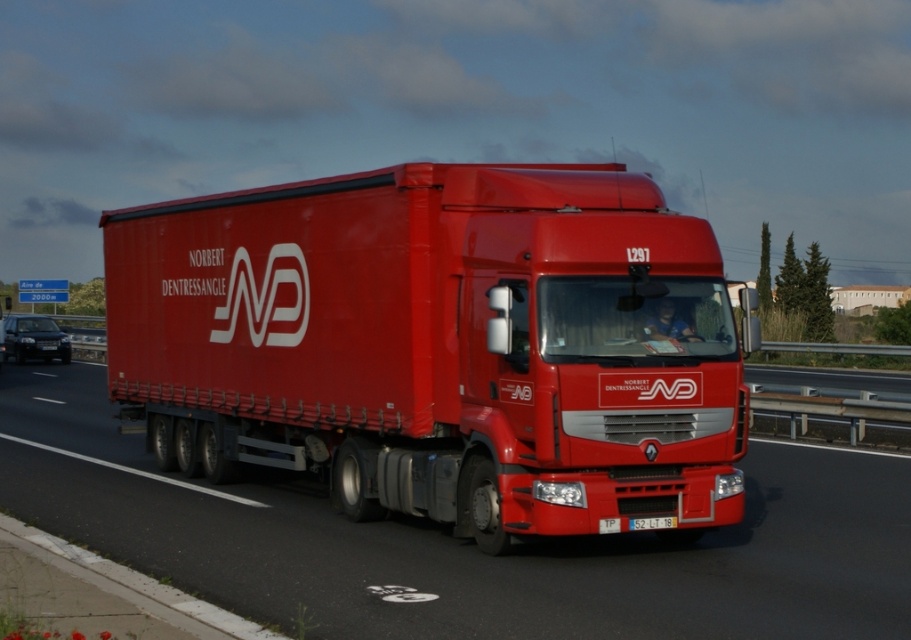
You are a driver looking at the highway and see the matte red trailer truck at center and the white plastic license plate at center. Which object is positioned higher from the ground?

The matte red trailer truck at center is above the white plastic license plate at center, so the matte red trailer truck at center is positioned higher from the ground.

You are a photographer trying to capture the matte red truck at center and the white plastic license plate at center in a single shot. Given that your camera has a fixed focal length, which object should you frame closer to the edge of the frame to ensure both are fully visible?

The matte red truck at center is wider than the white plastic license plate at center, so you should frame the matte red truck at center closer to the edge of the frame to ensure both are fully visible.

You are a driver approaching the highway and see the matte red truck at center and the white plastic license plate at center. Which object is positioned more to the left?

The matte red truck at center is positioned to the left of the white plastic license plate at center.